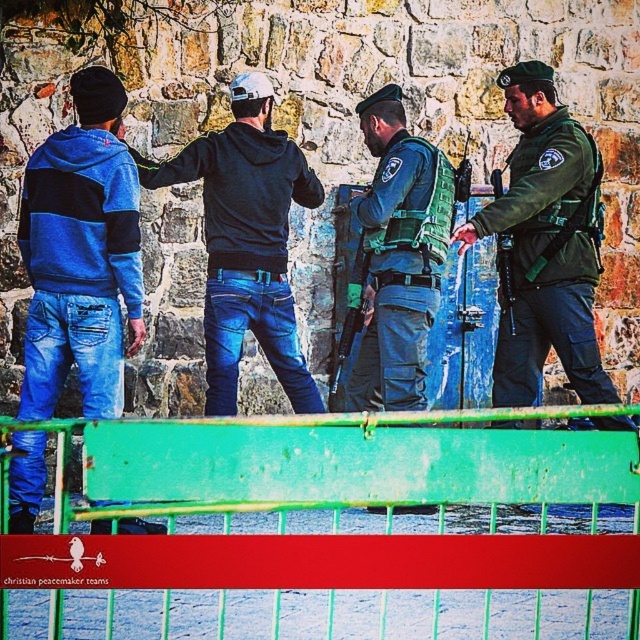
You are a security guard in the area and need to identify which person is closer to you between the blue striped hoodie at left and the green uniformed officer at center. Based on the scene, which individual is nearer?

The blue striped hoodie at left is closer to the viewer than the green uniformed officer at center, so the blue striped hoodie at left is nearer.

Consider the image. You are trying to decide which hoodie to wear for a hike. You prefer a wider hoodie for comfort. Based on the image, which one between the blue striped hoodie at left and the dark blue hoodie at center would you choose?

The dark blue hoodie at center is wider than the blue striped hoodie at left, so you should choose the dark blue hoodie at center for a more comfortable fit.